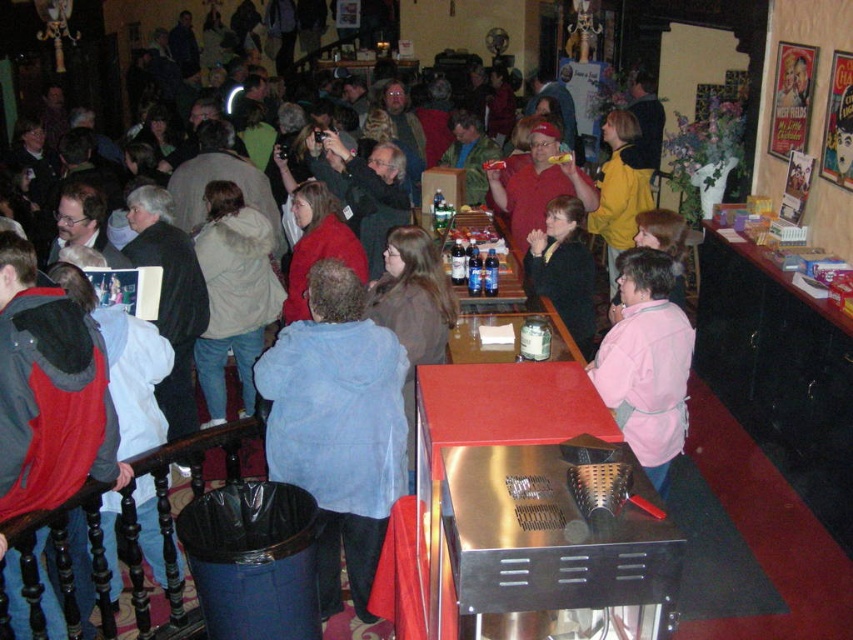
Question: Is red jacket at left to the left of beige fuzzy coat at center from the viewer's perspective?

Choices:
 (A) yes
 (B) no

Answer: (B)

Question: Is red jacket at left bigger than beige fuzzy coat at center?

Choices:
 (A) yes
 (B) no

Answer: (B)

Question: Can you confirm if pink fleece jacket at center is wider than beige fuzzy coat at center?

Choices:
 (A) no
 (B) yes

Answer: (A)

Question: Which object is closer to the camera taking this photo?

Choices:
 (A) pink fleece jacket at center
 (B) beige fuzzy coat at center
 (C) red jacket at left

Answer: (C)

Question: Which object appears farthest from the camera in this image?

Choices:
 (A) beige fuzzy coat at center
 (B) black matte jacket at center
 (C) blue fleece jacket at center

Answer: (A)

Question: Which is nearer to the red jacket at left?

Choices:
 (A) pink fleece jacket at center
 (B) beige fuzzy coat at center
 (C) blue fleece jacket at center

Answer: (C)